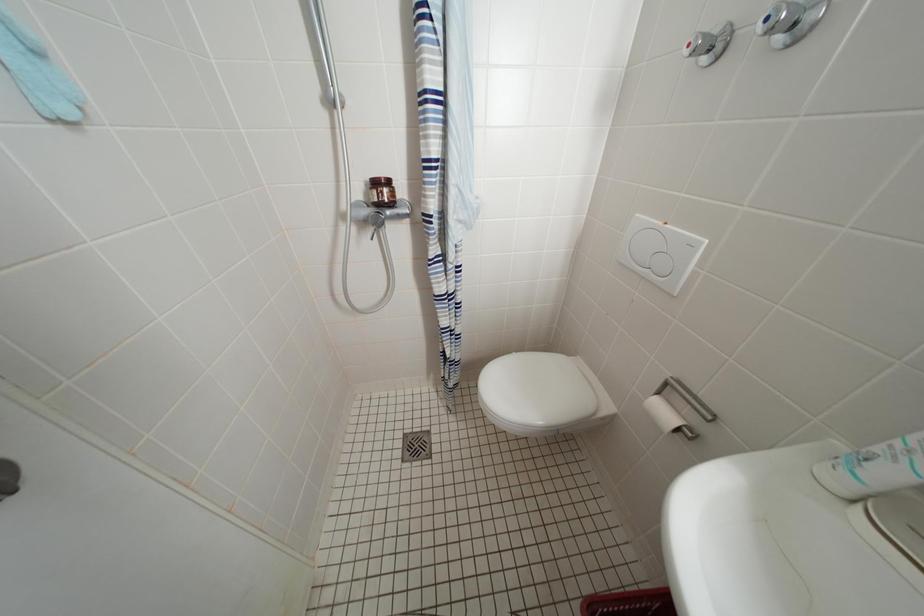
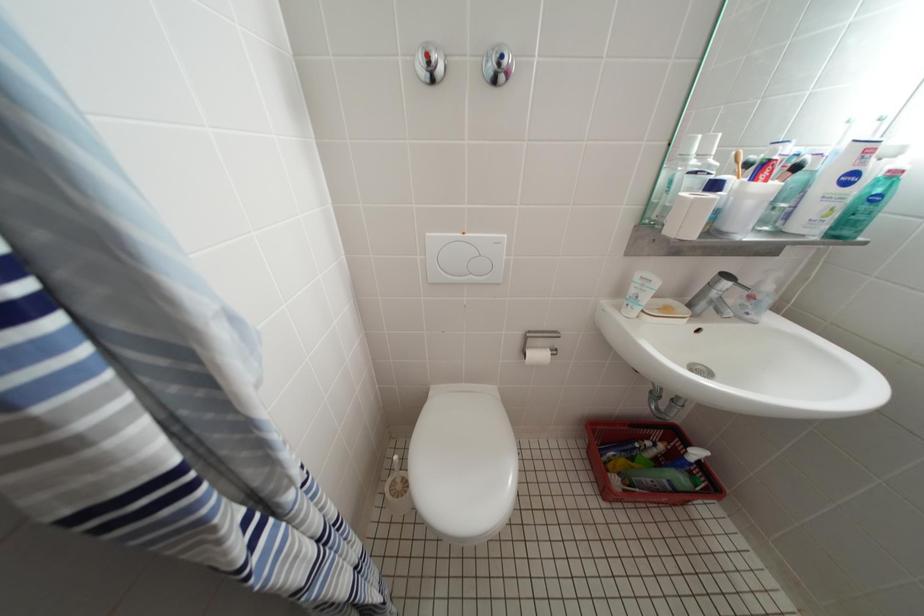
Based on the continuous images, in which direction is the camera rotating?

The camera's rotation is toward right-down.